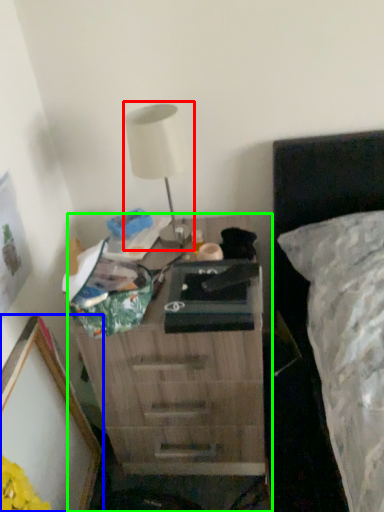
Question: Considering the real-world distances, which object is closest to table lamp (highlighted by a red box)? picture frame (highlighted by a blue box) or nightstand (highlighted by a green box).

Choices:
 (A) picture frame
 (B) nightstand

Answer: (B)